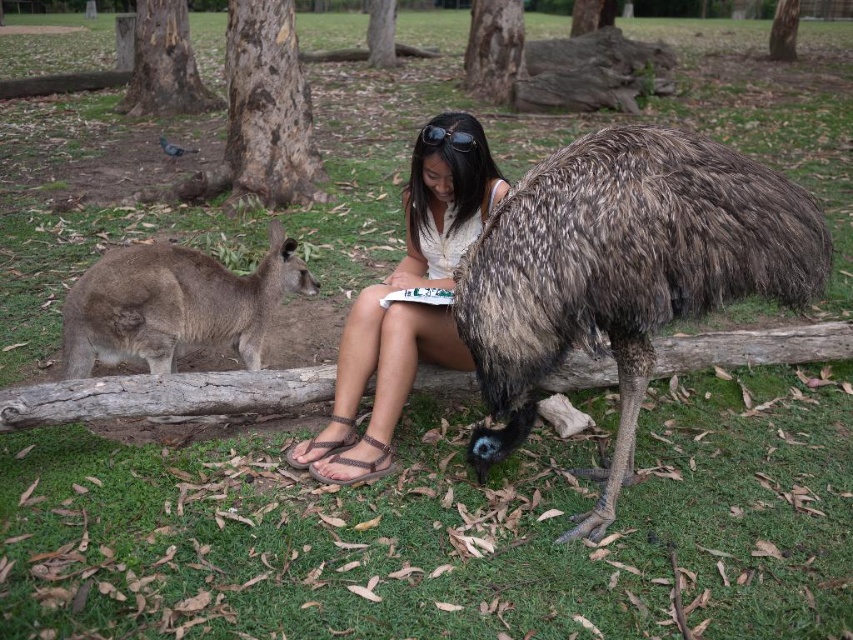
Question: Which point is farther to the camera?

Choices:
 (A) (334, 481)
 (B) (165, 144)

Answer: (B)

Question: Does brown leather sandal at lower center appear on the right side of gray feathered pigeon at upper left?

Choices:
 (A) no
 (B) yes

Answer: (B)

Question: Which point appears closest to the camera in this image?

Choices:
 (A) (426, 132)
 (B) (683, 136)
 (C) (169, 148)

Answer: (B)

Question: Is brown speckled feathers at center to the right of white fabric shirt at center from the viewer's perspective?

Choices:
 (A) no
 (B) yes

Answer: (B)

Question: Which point is farther from the camera taking this photo?

Choices:
 (A) (408, 179)
 (B) (346, 461)
 (C) (424, 132)

Answer: (A)

Question: Can you confirm if brown furry kangaroo at left is bigger than brown leather sandal at lower center?

Choices:
 (A) yes
 (B) no

Answer: (A)